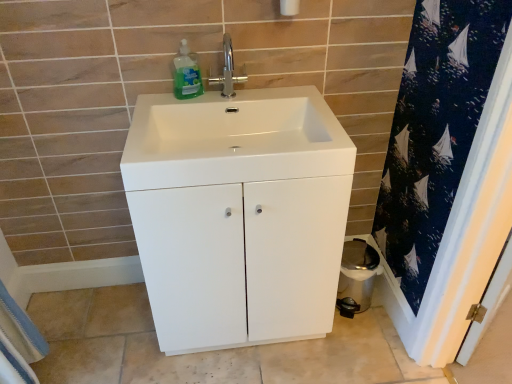
Locate an element on the screen. vacant space behind white cotton bath towel at lower left is located at coordinates (49, 306).